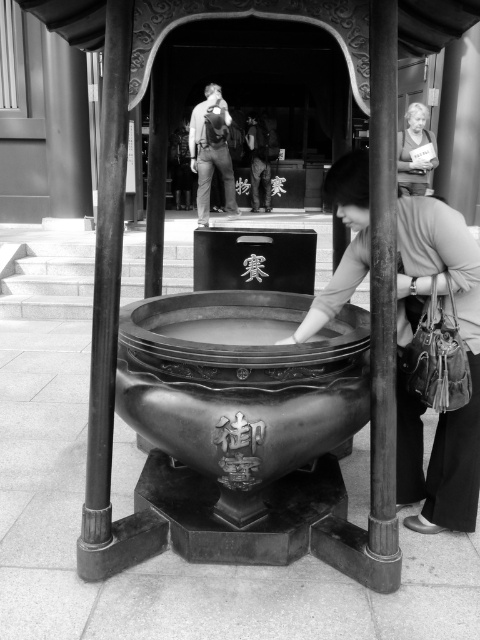
You are a visitor at the temple and want to know which object is bigger between the matte bronze bowl at center and the polished bronze pole at left. Can you tell me?

The matte bronze bowl at center is larger in size than the polished bronze pole at left.

You are a photographer trying to capture the bronze basin under the wooden canopy. You notice two elements in the scene that might distract from the basin. Which of the two objects, the matte black backpack at center or the matte gray hair at upper right, is positioned closer to the left side of your frame?

The matte black backpack at center is to the left of the matte gray hair at upper right, so it is closer to the left side of the frame.

You are standing at the temple and want to determine the relative positions of two points in the scene. Which of the two points, point (368, 170) or point (208, 108), is closer to you?

Point (368, 170) is closer to the viewer than point (208, 108).